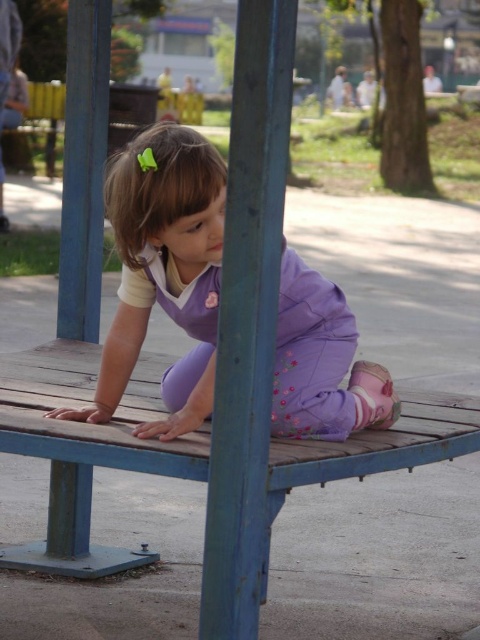
Who is lower down, wooden bench at center or purple fabric at center?

wooden bench at center is below.

Identify the location of wooden bench at center. Image resolution: width=480 pixels, height=640 pixels. (197, 468).

The height and width of the screenshot is (640, 480). Find the location of `wooden bench at center`. wooden bench at center is located at coordinates (197, 468).